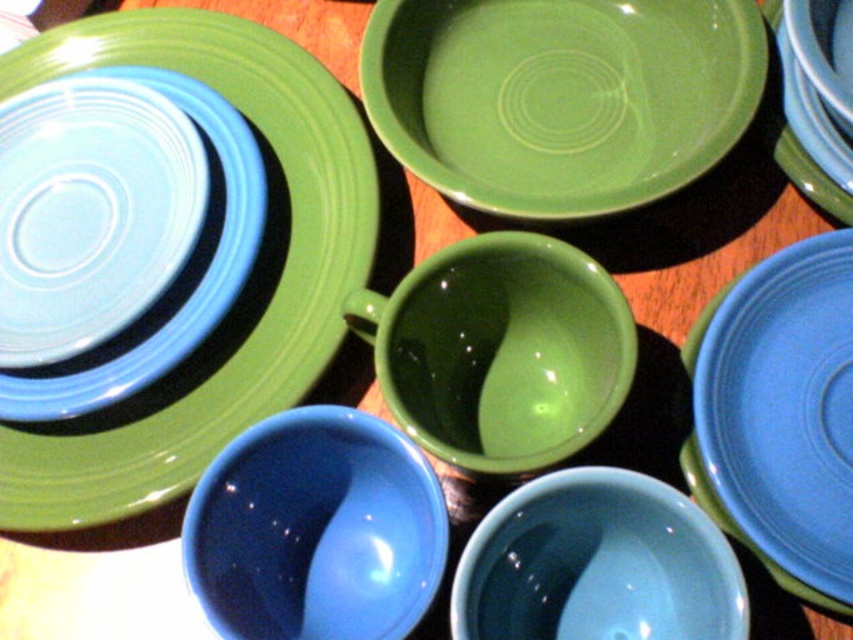
You are organizing a dinner party and need to place a blue glossy bowl at lower center on top of a matte ceramic plate at upper left. Will the bowl fit entirely on the plate without overhanging?

The matte ceramic plate at upper left might be wider than blue glossy bowl at lower center, so there is a possibility that the bowl will fit, but it is uncertain. Check the exact measurements to confirm.